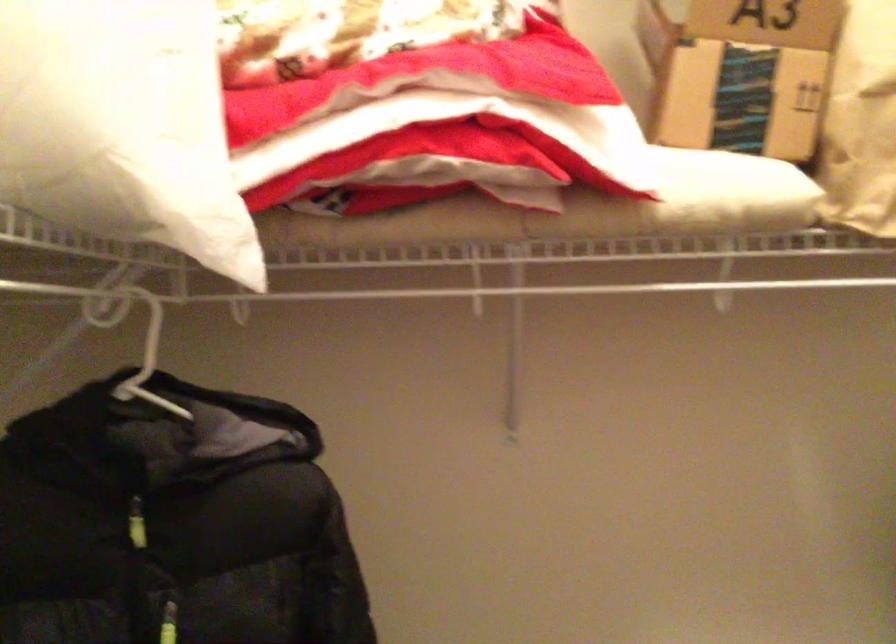
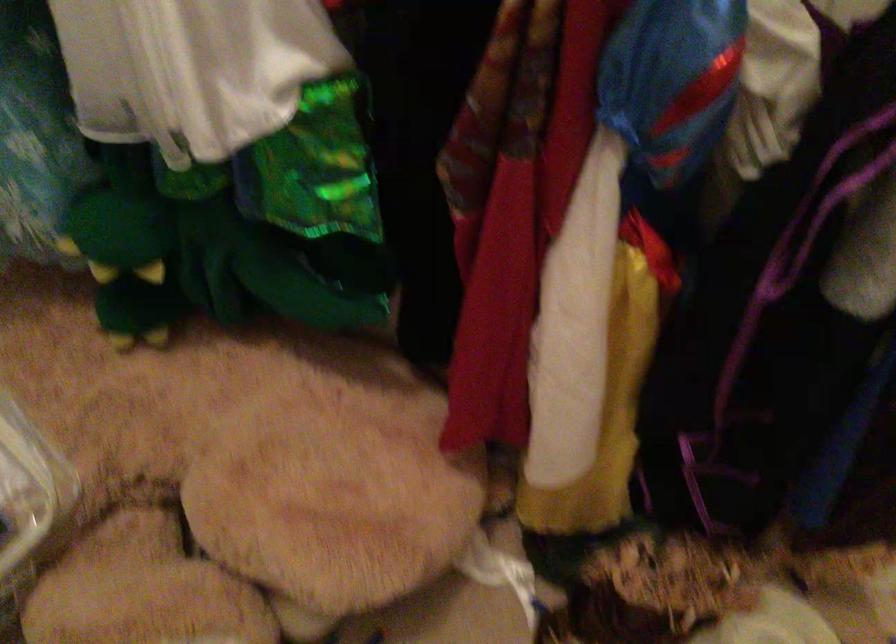
How did the camera likely rotate?

The camera's rotation is toward right-down.